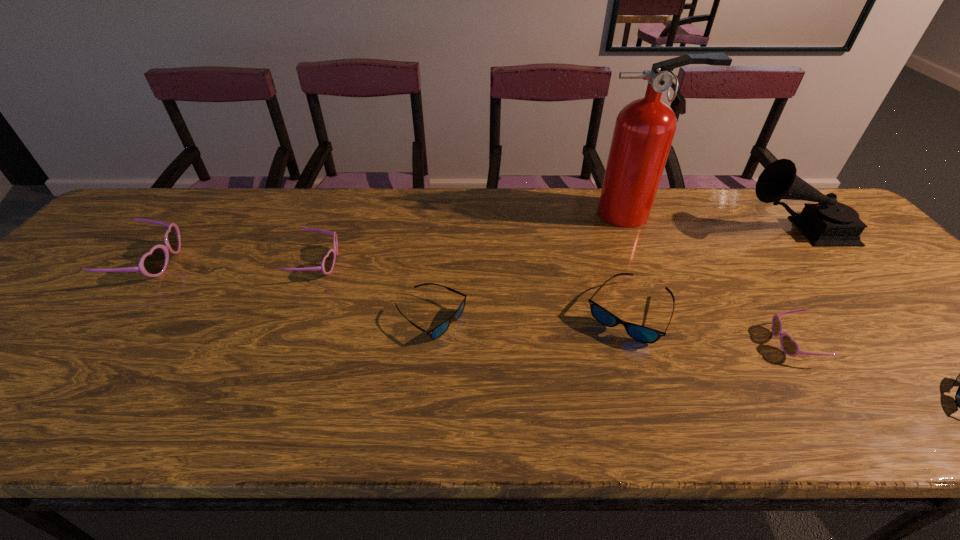
Identify the location of free space at the left edge of the desktop. (122, 278).

This screenshot has height=540, width=960. In order to click on vacant space at the right edge of the desktop in this screenshot , I will do `click(948, 349)`.

At what (x,y) coordinates should I click in order to perform the action: click on free space between the rightmost pink sunglasses and the fourth sunglasses from right to left. Please return your answer as a coordinate pair (x, y). Looking at the image, I should click on (612, 330).

The image size is (960, 540). Identify the location of vacant area between the second pink sunglasses from left to right and the third sunglasses from left to right. (374, 291).

Find the location of `empty space that is in between the leftmost sunglasses and the third sunglasses from right to left`. empty space that is in between the leftmost sunglasses and the third sunglasses from right to left is located at coordinates (389, 288).

At what (x,y) coordinates should I click in order to perform the action: click on empty space between the second pink sunglasses from left to right and the tallest sunglasses. Please return your answer as a coordinate pair (x, y). Looking at the image, I should click on (234, 263).

This screenshot has width=960, height=540. In order to click on vacant region between the phonograph_record and the tallest object in this screenshot , I will do `click(714, 221)`.

You are a GUI agent. You are given a task and a screenshot of the screen. Output one action in this format:
    pyautogui.click(x=<x>, y=<y>)
    Task: Click on the free space between the second pink sunglasses from right to left and the third tallest object
    
    Given the screenshot: What is the action you would take?
    pyautogui.click(x=234, y=263)

The width and height of the screenshot is (960, 540). Find the location of `free space between the second object from left to right and the third sunglasses from right to left`. free space between the second object from left to right and the third sunglasses from right to left is located at coordinates (472, 288).

This screenshot has height=540, width=960. I want to click on empty space that is in between the leftmost sunglasses and the second biggest blue sunglasses, so click(291, 291).